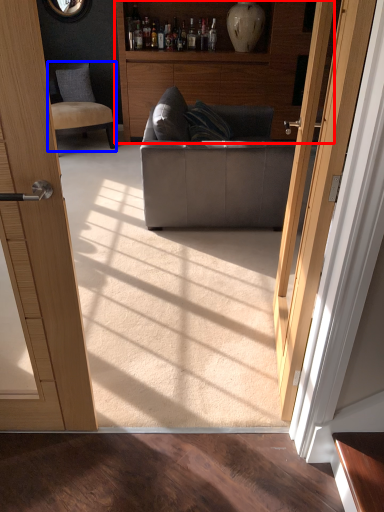
Question: Which point is closer to the camera, cabinetry (highlighted by a red box) or chair (highlighted by a blue box)?

Choices:
 (A) cabinetry
 (B) chair

Answer: (B)